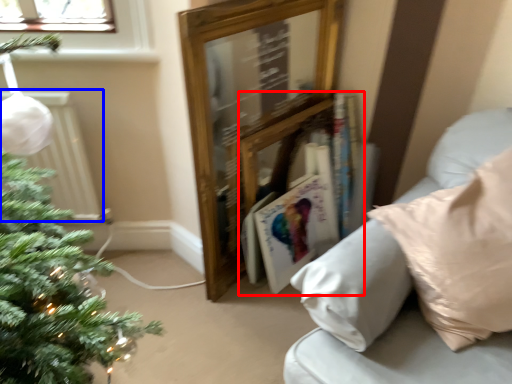
Question: Among these objects, which one is nearest to the camera, book (highlighted by a red box) or radiator (highlighted by a blue box)?

Choices:
 (A) book
 (B) radiator

Answer: (B)